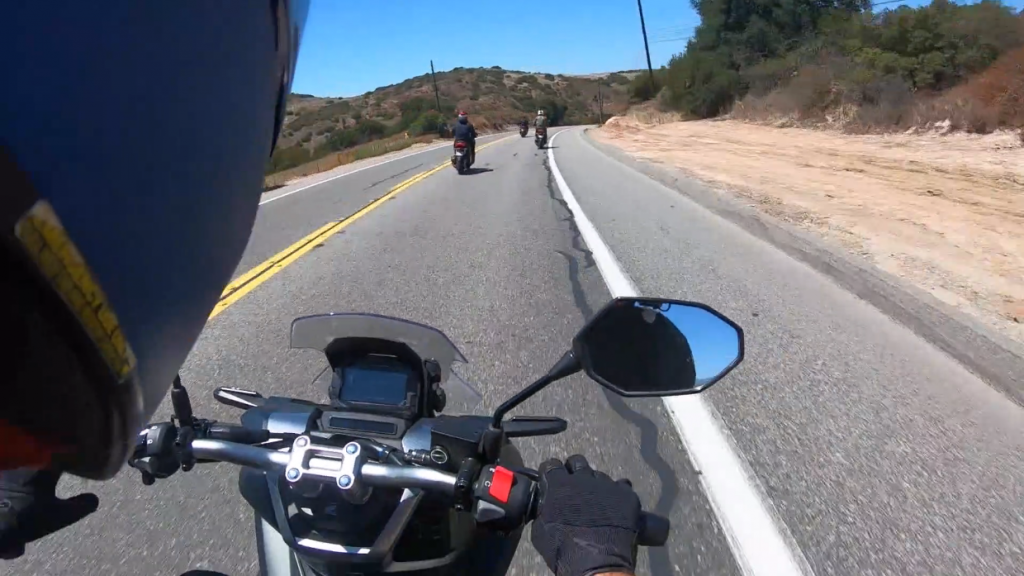
The height and width of the screenshot is (576, 1024). I want to click on mirror, so click(x=693, y=338).